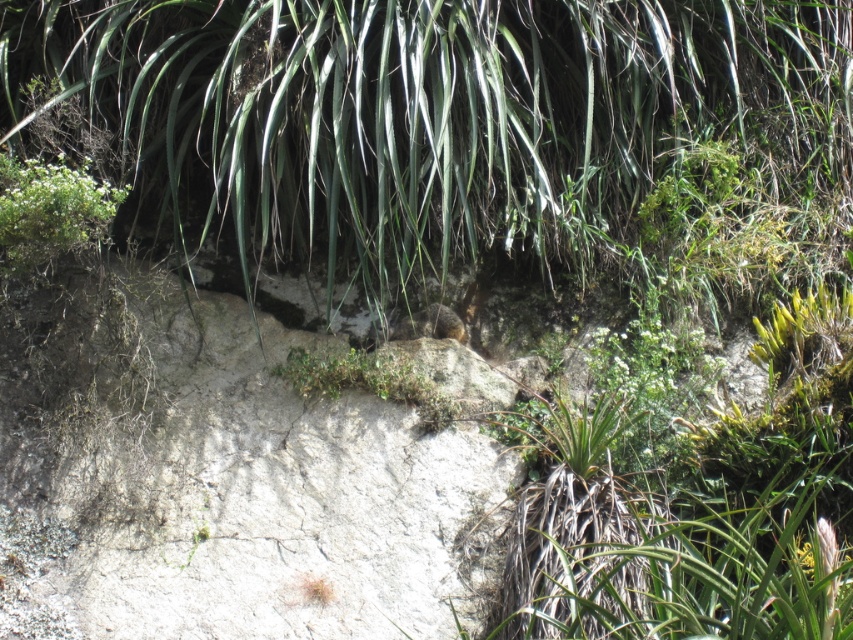
Is green leafy plant at upper center positioned behind green leafy plant at upper left?

Yes, it is.

In the scene shown: Does green leafy plant at upper center have a lesser height compared to green leafy plant at upper left?

No, green leafy plant at upper center is not shorter than green leafy plant at upper left.

Is point (242, 259) in front of point (32, 234)?

No, (242, 259) is further to viewer.

What are the coordinates of `green leafy plant at upper center` in the screenshot? It's located at (433, 115).